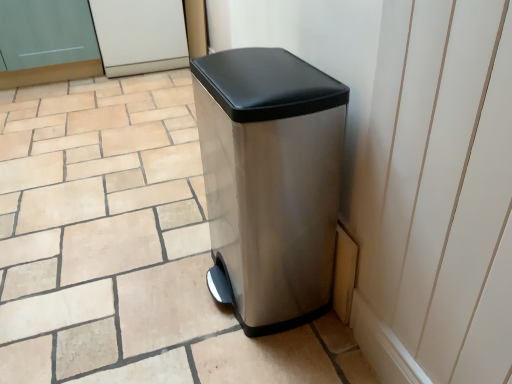
I want to click on vacant region to the left of stainless steel trash can at center, so click(145, 294).